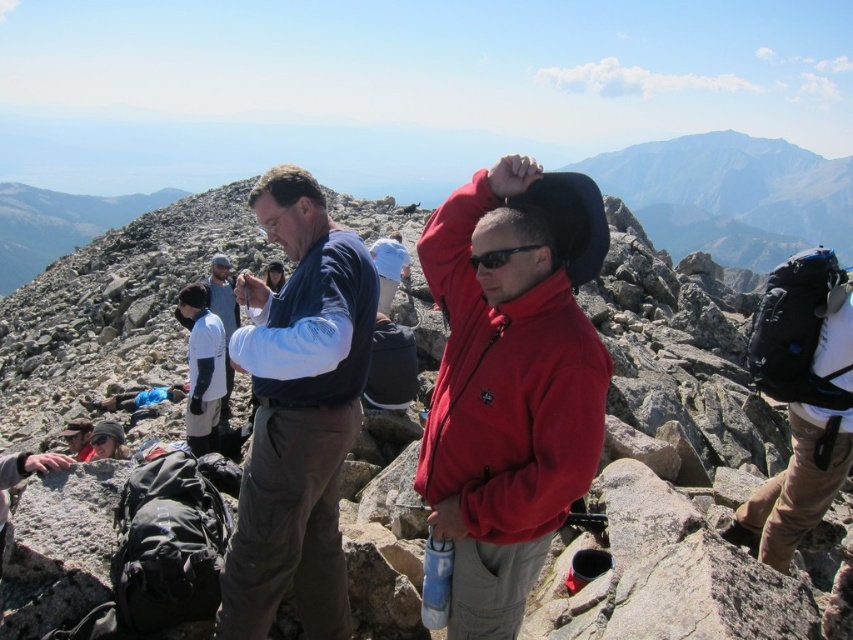
You are a hiker who just reached the summit. You see a point marked at coordinates (556,456). What does this point represent in the scene?

The point at coordinates (556,456) corresponds to the rugged stone mountain at center.